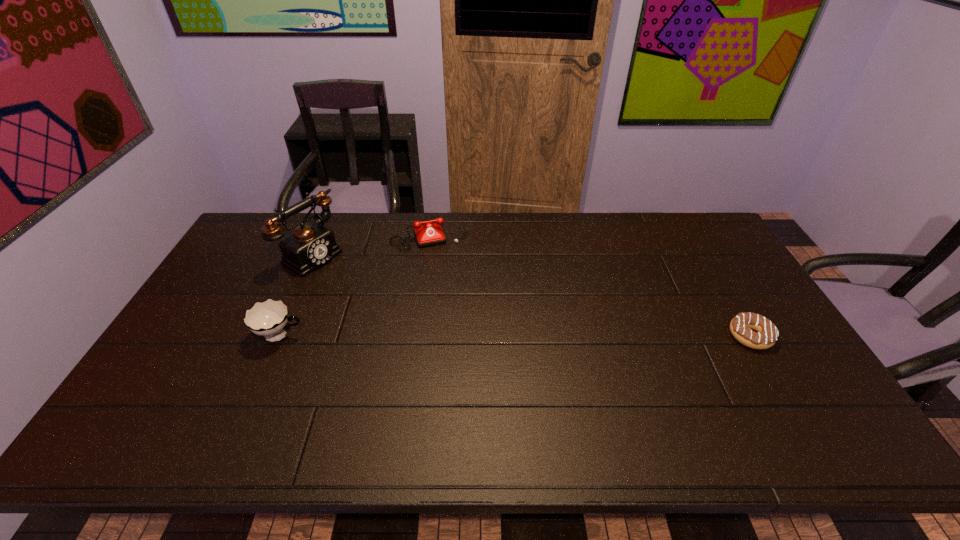
Locate an element on the screen. unoccupied area between the rightmost object and the third tallest object is located at coordinates (589, 285).

Select which object appears as the third closest to the tallest object. Please provide its 2D coordinates. Your answer should be formatted as a tuple, i.e. [(x, y)], where the tuple contains the x and y coordinates of a point satisfying the conditions above.

[(766, 335)]

What are the coordinates of `the second closest object to the tallest object` in the screenshot? It's located at (269, 318).

The width and height of the screenshot is (960, 540). Find the location of `free space that satisfies the following two spatial constraints: 1. on the front side of the taller telephone; 2. on the side of the third shortest object with the handle`. free space that satisfies the following two spatial constraints: 1. on the front side of the taller telephone; 2. on the side of the third shortest object with the handle is located at coordinates (278, 336).

The image size is (960, 540). What are the coordinates of `free space that satisfies the following two spatial constraints: 1. on the front side of the second tallest object; 2. on the side of the tallest object with the handle` in the screenshot? It's located at (278, 336).